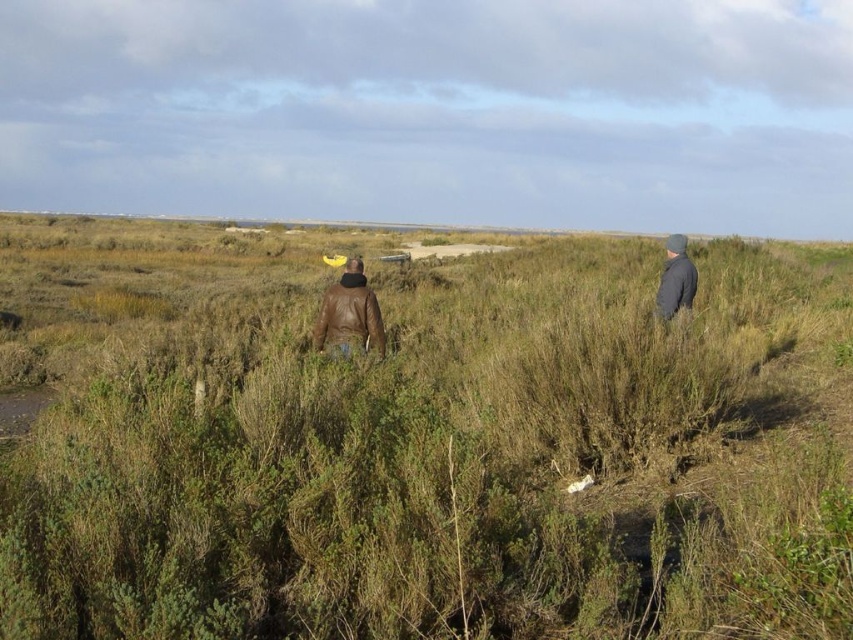
You are a photographer trying to capture a landscape shot of the green grassy at center and the gray woolen hat at right. Which object should you focus on first if you want to ensure both are in focus, considering their heights?

The green grassy at center is taller than the gray woolen hat at right. To ensure both are in focus, you should focus on the green grassy at center first since it is the taller object and adjusting the focus from there would help capture both heights effectively.

You are a drone operator trying to capture a photo of the two people in the field. Your drone can only fly within a 4 meter radius from the target. If you aim to focus on the brown leather jacket at center, will the gray woolen hat at right be within the drone camera frame?

The brown leather jacket at center is 3.85 meters away from gray woolen hat at right. Since the drone can fly within a 4 meter radius, the gray woolen hat at right will be within the camera frame as the distance is less than 4 meters.

You are a hiker who wants to place a small tent on the green grassy at center without it being covered by the brown leather jacket at center. Is this possible?

The green grassy at center is positioned over the brown leather jacket at center, so placing the tent there would result in it being under the jacket. To avoid coverage, the tent should be placed elsewhere.